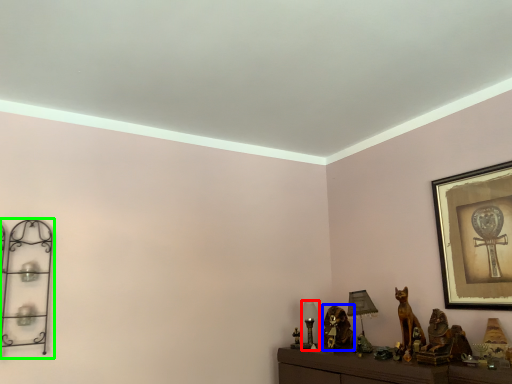
Question: Considering the real-world distances, which object is farthest from table lamp (highlighted by a red box)? animal (highlighted by a blue box) or shelf (highlighted by a green box)?

Choices:
 (A) animal
 (B) shelf

Answer: (B)